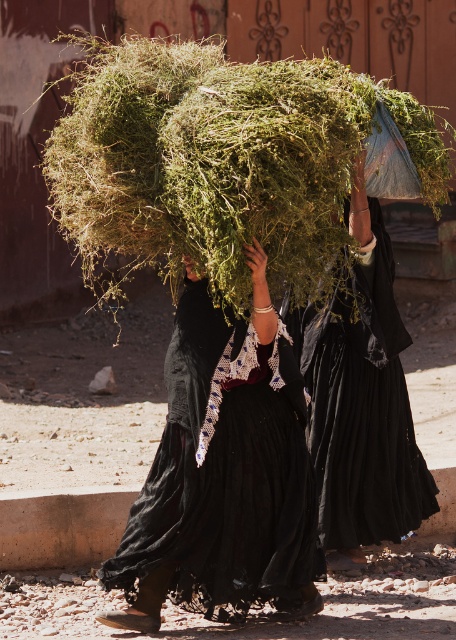
You are a photographer trying to capture the scene where the two people are walking. You want to ensure that the green grassy hay at center and the black matte dress at center are both visible in your shot. Based on their positions, which object should you focus on first to frame them properly?

The green grassy hay at center is to the left of black matte dress at center. To frame them properly, focus on the green grassy hay at center first since it is positioned to the left, ensuring both objects are included in the shot.

You are standing at the origin point of the coordinate system. The green grassy hay at center is located at point (219, 163). Which direction should you move to reach the green grassy hay at center?

The green grassy hay at center is located at point (219, 163). To reach it from the origin, you should move northeast since the coordinates are positive in both x and y directions.